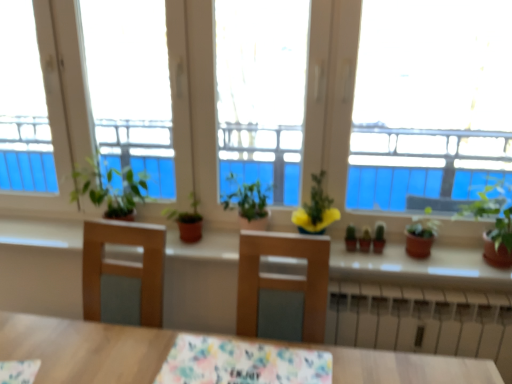
Question: Is floral fabric tablecloth at center looking in the opposite direction of green matte plant at center, the 5th houseplant from the right?

Choices:
 (A) no
 (B) yes

Answer: (A)

Question: Is floral fabric tablecloth at center aimed at green matte plant at center, the 5th houseplant from the right?

Choices:
 (A) no
 (B) yes

Answer: (A)

Question: Is floral fabric tablecloth at center surrounding green matte plant at center, the first houseplant when ordered from left to right?

Choices:
 (A) no
 (B) yes

Answer: (A)

Question: Is floral fabric tablecloth at center smaller than green matte plant at center, the 5th houseplant from the right?

Choices:
 (A) yes
 (B) no

Answer: (A)

Question: From the image's perspective, is floral fabric tablecloth at center on green matte plant at center, the first houseplant when ordered from left to right?

Choices:
 (A) yes
 (B) no

Answer: (B)

Question: In terms of size, does green matte plant at center, the 5th houseplant from the right, appear bigger or smaller than green matte cactus at center, the 2th plant viewed from the right?

Choices:
 (A) small
 (B) big

Answer: (B)

Question: Is point (187, 228) closer or farther from the camera than point (349, 233)?

Choices:
 (A) farther
 (B) closer

Answer: (B)

Question: Is green matte plant at center, the 5th houseplant from the right, taller or shorter than green matte cactus at center, the 2th plant viewed from the right?

Choices:
 (A) short
 (B) tall

Answer: (B)

Question: Relative to green matte cactus at center, the 2th plant viewed from the right, is green matte plant at center, the 5th houseplant from the right, in front or behind?

Choices:
 (A) behind
 (B) front

Answer: (A)

Question: From the image's perspective, is matte brown pot at right, acting as the fourth houseplant starting from the left, above or below yellow matte flower pot at center, the third houseplant when ordered from left to right?

Choices:
 (A) above
 (B) below

Answer: (B)

Question: Would you say matte brown pot at right, which is the second houseplant from right to left, is inside or outside yellow matte flower pot at center, which ranks as the third houseplant in right-to-left order?

Choices:
 (A) outside
 (B) inside

Answer: (A)

Question: Is matte brown pot at right, which is the second houseplant from right to left, taller or shorter than yellow matte flower pot at center, the third houseplant when ordered from left to right?

Choices:
 (A) tall
 (B) short

Answer: (B)

Question: Considering the positions of matte brown pot at right, acting as the fourth houseplant starting from the left, and yellow matte flower pot at center, which ranks as the third houseplant in right-to-left order, in the image, is matte brown pot at right, acting as the fourth houseplant starting from the left, bigger or smaller than yellow matte flower pot at center, which ranks as the third houseplant in right-to-left order,?

Choices:
 (A) big
 (B) small

Answer: (B)

Question: Is point (353, 236) closer or farther from the camera than point (375, 228)?

Choices:
 (A) farther
 (B) closer

Answer: (A)

Question: Based on their sizes in the image, would you say green matte cactus at center, the 2th plant viewed from the right, is bigger or smaller than green matte plant at center, which is the 1th plant in right-to-left order?

Choices:
 (A) big
 (B) small

Answer: (B)